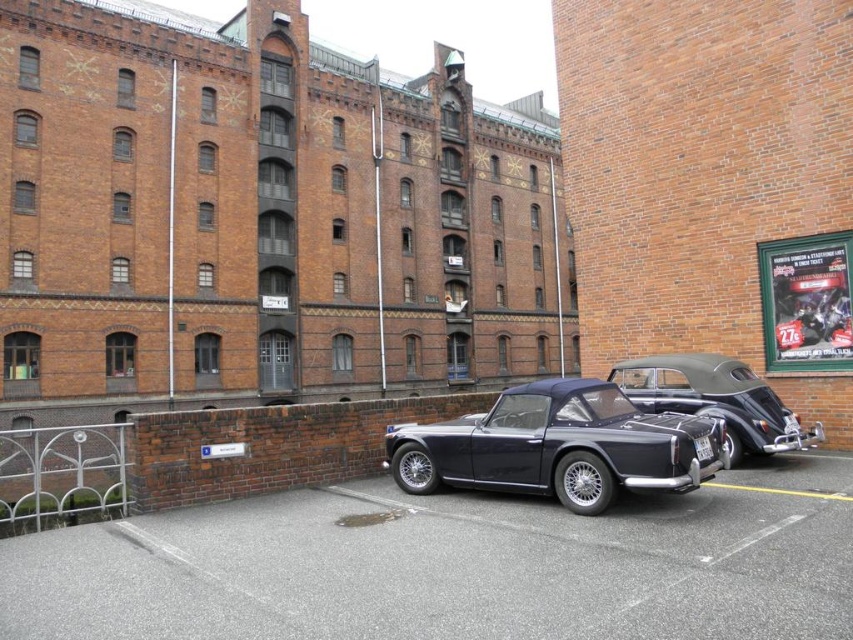
Consider the image. Can you confirm if black asphalt parking lot at center is positioned above shiny black convertible at center?

No, black asphalt parking lot at center is not above shiny black convertible at center.

Which is in front, point (293, 561) or point (646, 388)?

Positioned in front is point (293, 561).

Does point (251, 612) lie behind point (694, 387)?

No, it is in front of (694, 387).

Locate an element on the screen. black asphalt parking lot at center is located at coordinates (454, 564).

Between satin black convertible at center and shiny black convertible at center, which one appears on the left side from the viewer's perspective?

satin black convertible at center is more to the left.

Between point (553, 404) and point (712, 400), which one is positioned in front?

Point (553, 404)

The height and width of the screenshot is (640, 853). In order to click on satin black convertible at center in this screenshot , I will do `click(560, 445)`.

Can you confirm if black asphalt parking lot at center is positioned to the left of satin black convertible at center?

Yes, black asphalt parking lot at center is to the left of satin black convertible at center.

Does black asphalt parking lot at center appear on the right side of satin black convertible at center?

In fact, black asphalt parking lot at center is to the left of satin black convertible at center.

Does point (376, 566) lie behind point (634, 419)?

No, (376, 566) is in front of (634, 419).

Identify the location of black asphalt parking lot at center. The width and height of the screenshot is (853, 640). (454, 564).